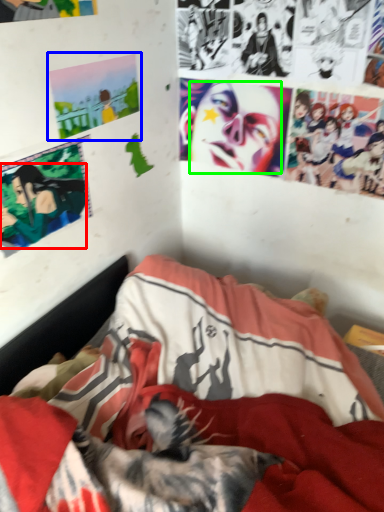
Question: Estimate the real-world distances between objects in this image. Which object is closer to person (highlighted by a red box), poster page (highlighted by a blue box) or human face (highlighted by a green box)?

Choices:
 (A) poster page
 (B) human face

Answer: (A)